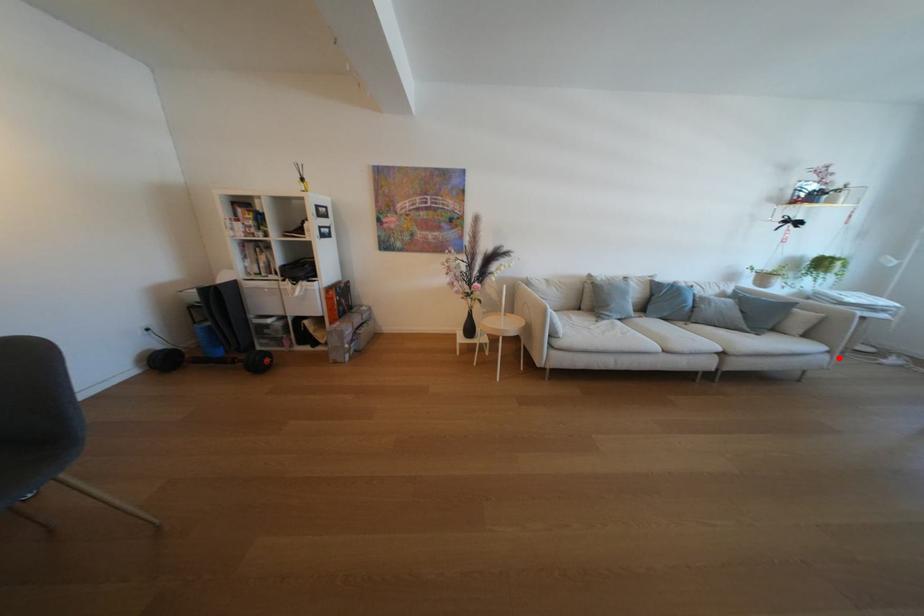
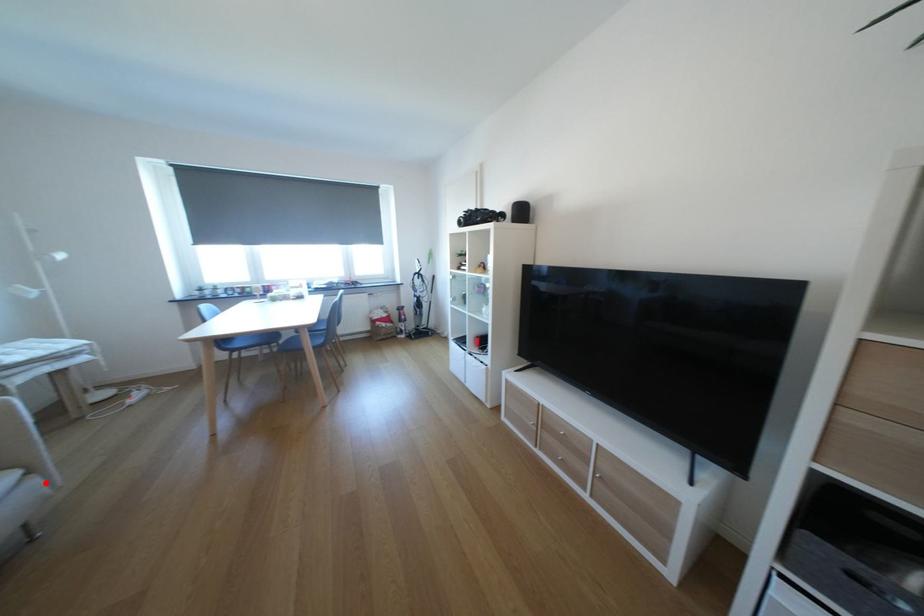
I am providing you with two images of the same scene from different viewpoints. A red point is marked on the first image and another point is marked on the second image. Is the red point in image1 aligned with the point shown in image2?

Yes